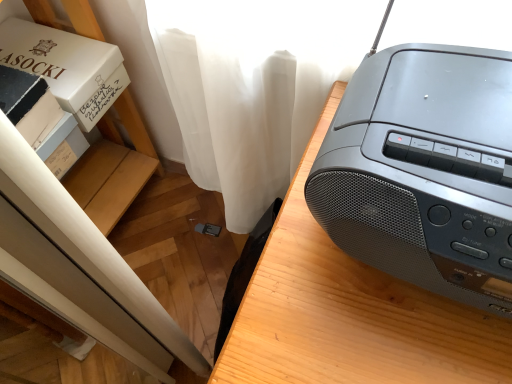
Question: Is the surface of white cardboard box at left in direct contact with white cardboard box at upper left?

Choices:
 (A) yes
 (B) no

Answer: (B)

Question: Is white cardboard box at upper left completely or partially inside white cardboard box at left?

Choices:
 (A) yes
 (B) no

Answer: (B)

Question: From the image's perspective, does white cardboard box at left appear lower than white cardboard box at upper left?

Choices:
 (A) yes
 (B) no

Answer: (A)

Question: Is the position of white cardboard box at left less distant than that of white cardboard box at upper left?

Choices:
 (A) no
 (B) yes

Answer: (A)

Question: Considering the relative positions of white cardboard box at left and white cardboard box at upper left in the image provided, is white cardboard box at left to the right of white cardboard box at upper left from the viewer's perspective?

Choices:
 (A) no
 (B) yes

Answer: (A)

Question: Can you confirm if white cardboard box at left is bigger than white cardboard box at upper left?

Choices:
 (A) yes
 (B) no

Answer: (B)

Question: From the image's perspective, is matte black boombox at right under matte black radio at upper right?

Choices:
 (A) no
 (B) yes

Answer: (B)

Question: Can you confirm if matte black boombox at right is positioned to the right of matte black radio at upper right?

Choices:
 (A) yes
 (B) no

Answer: (A)

Question: Can we say matte black boombox at right lies outside matte black radio at upper right?

Choices:
 (A) no
 (B) yes

Answer: (B)

Question: From a real-world perspective, is matte black boombox at right on matte black radio at upper right?

Choices:
 (A) yes
 (B) no

Answer: (B)

Question: Can matte black radio at upper right be found inside matte black boombox at right?

Choices:
 (A) yes
 (B) no

Answer: (B)

Question: Is matte black boombox at right behind matte black radio at upper right?

Choices:
 (A) yes
 (B) no

Answer: (B)

Question: Does white cardboard box at upper left come behind white cardboard box at upper left?

Choices:
 (A) yes
 (B) no

Answer: (A)